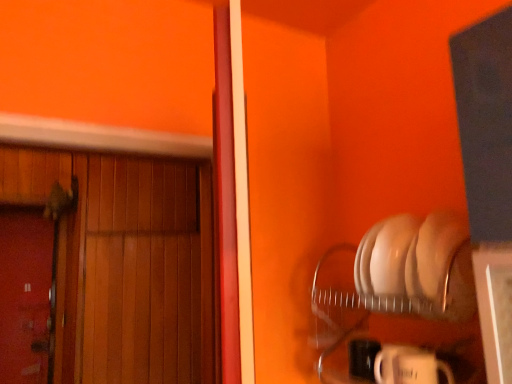
Question: Is smooth wooden door at left, acting as the second door starting from the right, wider or thinner than wooden door at left, which appears as the second door when viewed from the left?

Choices:
 (A) wide
 (B) thin

Answer: (B)

Question: In the image, is smooth wooden door at left, acting as the second door starting from the right, positioned in front of or behind wooden door at left, which appears as the second door when viewed from the left?

Choices:
 (A) behind
 (B) front

Answer: (A)

Question: From the image's perspective, is smooth wooden door at left, the first door positioned from the left, positioned above or below wooden door at left, which appears as the second door when viewed from the left?

Choices:
 (A) below
 (B) above

Answer: (A)

Question: In the image, is wooden door at left, marked as the 1th door in a right-to-left arrangement, positioned in front of or behind smooth wooden door at left, acting as the second door starting from the right?

Choices:
 (A) front
 (B) behind

Answer: (A)

Question: Does point (197, 342) appear closer or farther from the camera than point (11, 306)?

Choices:
 (A) closer
 (B) farther

Answer: (A)

Question: From a real-world perspective, is wooden door at left, which appears as the second door when viewed from the left, physically located above or below smooth wooden door at left, the first door positioned from the left?

Choices:
 (A) above
 (B) below

Answer: (A)

Question: Is wooden door at left, which appears as the second door when viewed from the left, taller or shorter than smooth wooden door at left, acting as the second door starting from the right?

Choices:
 (A) tall
 (B) short

Answer: (A)